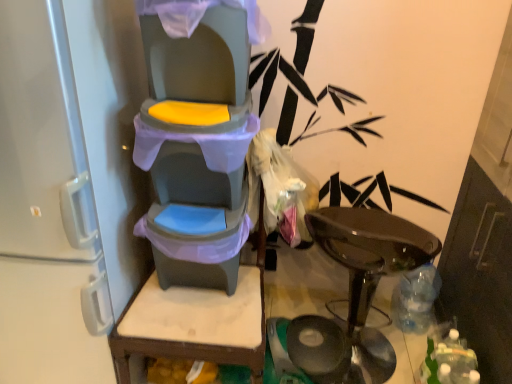
This screenshot has height=384, width=512. In order to click on glossy plastic stool at lower right in this screenshot , I will do `click(369, 250)`.

What is the approximate width of glossy plastic stool at lower right?

glossy plastic stool at lower right is 50.63 centimeters wide.

Describe the element at coordinates (369, 250) in the screenshot. I see `glossy plastic stool at lower right` at that location.

Where is `glossy plastic stool at lower right`? The height and width of the screenshot is (384, 512). glossy plastic stool at lower right is located at coordinates (369, 250).